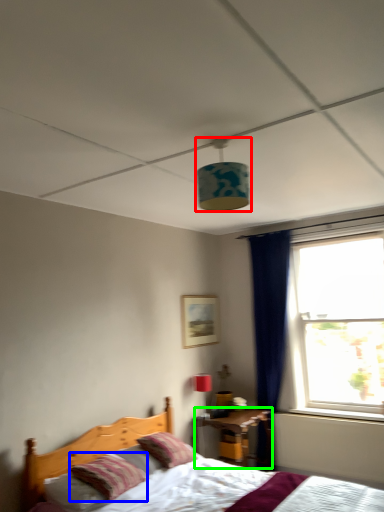
Question: Considering the real-world distances, which object is farthest from lamp (highlighted by a red box)? pillow (highlighted by a blue box) or nightstand (highlighted by a green box)?

Choices:
 (A) pillow
 (B) nightstand

Answer: (B)